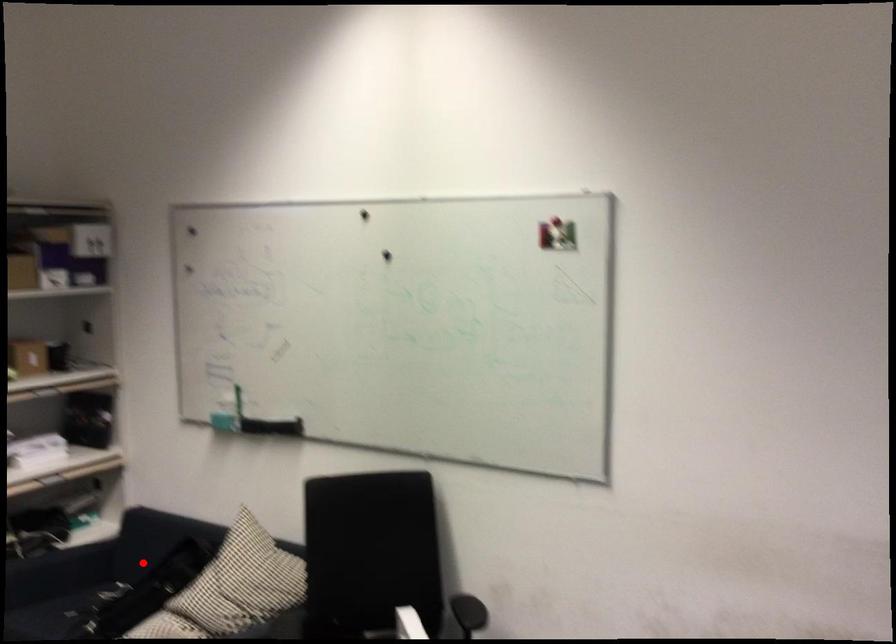
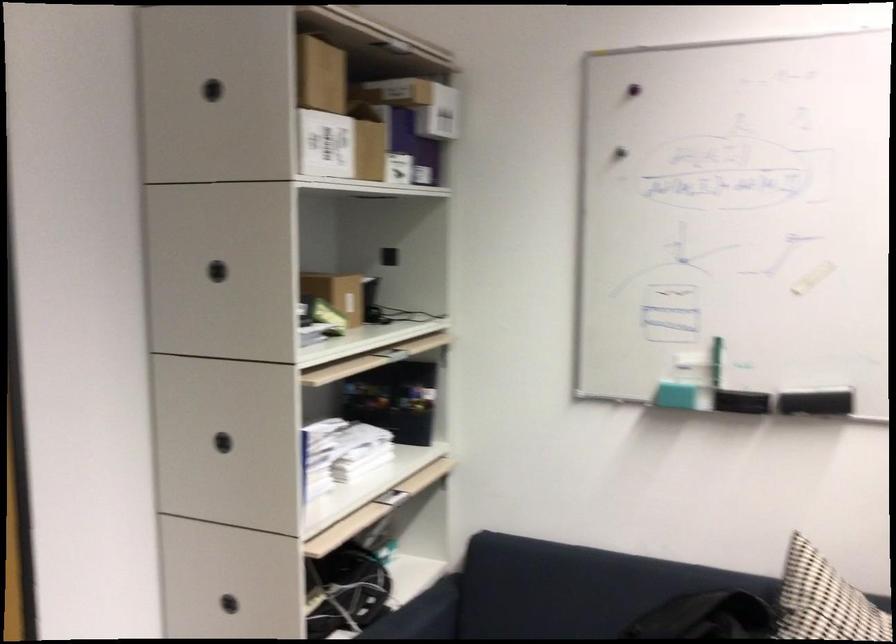
Question: A red point is marked in image1. In image2, is the corresponding 3D point closer to the camera or farther? Reply with the corresponding letter.

Choices:
 (A) The corresponding 3D point is closer.
 (B) The corresponding 3D point is farther.

Answer: (A)